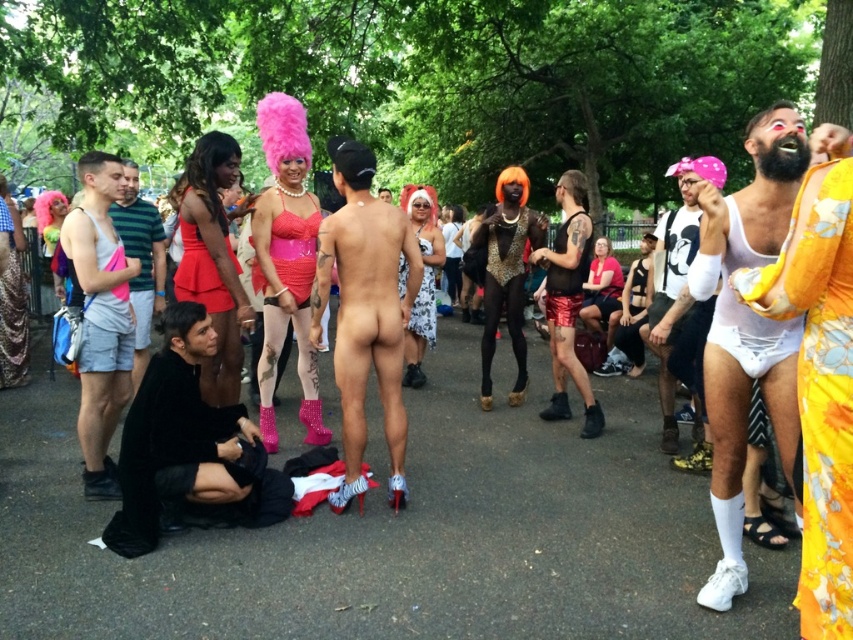
Does matte gray tank top at left have a greater height compared to black matte shorts at left?

Indeed, matte gray tank top at left has a greater height compared to black matte shorts at left.

Does matte gray tank top at left appear under black matte shorts at left?

Indeed, matte gray tank top at left is positioned under black matte shorts at left.

The height and width of the screenshot is (640, 853). What do you see at coordinates (102, 317) in the screenshot?
I see `matte gray tank top at left` at bounding box center [102, 317].

You are a GUI agent. You are given a task and a screenshot of the screen. Output one action in this format:
    pyautogui.click(x=<x>, y=<y>)
    Task: Click on the matte gray tank top at left
    
    Given the screenshot: What is the action you would take?
    pyautogui.click(x=102, y=317)

Between point (822, 227) and point (666, 234), which one is positioned behind?

Positioned behind is point (666, 234).

Is floral silk dress at right shorter than pink matte wig at upper right?

Yes, floral silk dress at right is shorter than pink matte wig at upper right.

Does point (813, 282) come in front of point (674, 262)?

Yes, it is in front of point (674, 262).

The image size is (853, 640). In order to click on floral silk dress at right in this screenshot , I will do `click(824, 396)`.

Between pink matte wig at upper right and black matte shorts at left, which one is positioned lower?

Positioned lower is pink matte wig at upper right.

Which is in front, point (675, 266) or point (131, 184)?

Point (675, 266) is more forward.

At what (x,y) coordinates should I click in order to perform the action: click on pink matte wig at upper right. Please return your answer as a coordinate pair (x, y). The height and width of the screenshot is (640, 853). Looking at the image, I should click on (x=670, y=289).